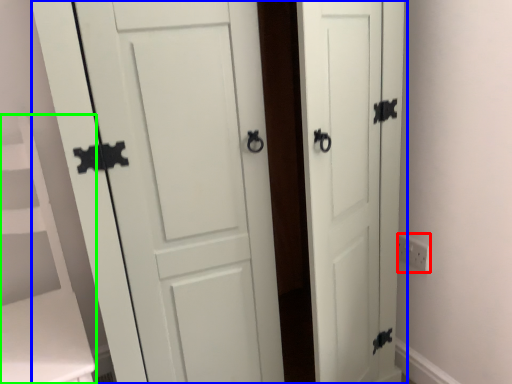
Question: Which is farther away from electric outlet (highlighted by a red box)? door (highlighted by a blue box) or vanity (highlighted by a green box)?

Choices:
 (A) door
 (B) vanity

Answer: (B)